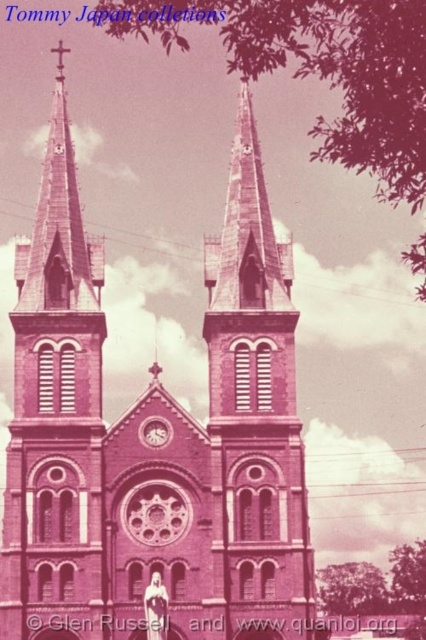
Between pink stone tower at center and matte pink clock at upper center, which one has less height?

With less height is matte pink clock at upper center.

Is pink stone tower at center in front of matte pink clock at upper center?

Yes, pink stone tower at center is in front of matte pink clock at upper center.

Measure the distance between point [259,308] and camera.

112.45 meters

The image size is (426, 640). What are the coordinates of `pink stone tower at center` in the screenshot? It's located at (253, 417).

Is pink stone church at center to the left of pink stone church steeple at center from the viewer's perspective?

In fact, pink stone church at center is to the right of pink stone church steeple at center.

What do you see at coordinates (152, 445) in the screenshot?
I see `pink stone church at center` at bounding box center [152, 445].

Is point (210, 278) positioned in front of point (69, 618)?

No, it is not.

At what (x,y) coordinates should I click in order to perform the action: click on pink stone church at center. Please return your answer as a coordinate pair (x, y). This screenshot has height=640, width=426. Looking at the image, I should click on (152, 445).

Who is more distant from viewer, (51, 556) or (150, 442)?

The point (150, 442) is more distant.

Which is in front, point (37, 212) or point (155, 428)?

Point (155, 428) is in front.

At what (x,y) coordinates should I click in order to perform the action: click on pink stone church steeple at center. Please return your answer as a coordinate pair (x, y). Image resolution: width=426 pixels, height=640 pixels. Looking at the image, I should click on tap(55, 416).